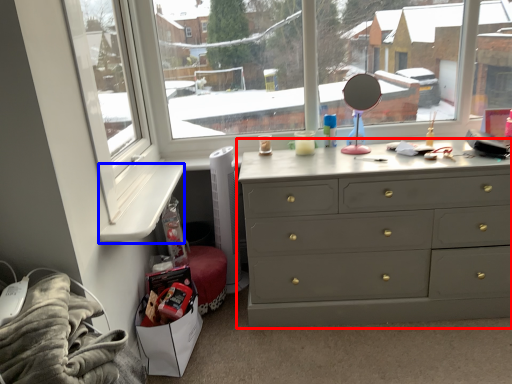
Question: Among these objects, which one is nearest to the camera, chest of drawers (highlighted by a red box) or window sill (highlighted by a blue box)?

Choices:
 (A) chest of drawers
 (B) window sill

Answer: (B)